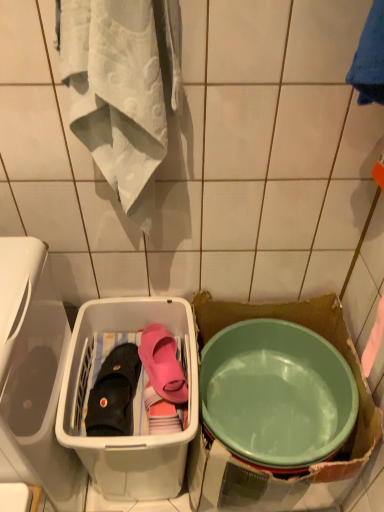
Question: Can you confirm if pink rubber slipper at center, placed as the 1th footwear when sorted from right to left, is smaller than black fabric slipper at lower left, positioned as the second footwear in right-to-left order?

Choices:
 (A) no
 (B) yes

Answer: (B)

Question: From a real-world perspective, is pink rubber slipper at center, placed as the 1th footwear when sorted from right to left, physically below black fabric slipper at lower left, the 1th footwear when ordered from left to right?

Choices:
 (A) no
 (B) yes

Answer: (A)

Question: From the image's perspective, is pink rubber slipper at center, placed as the 1th footwear when sorted from right to left, below black fabric slipper at lower left, positioned as the second footwear in right-to-left order?

Choices:
 (A) no
 (B) yes

Answer: (A)

Question: Is pink rubber slipper at center, which appears as the 2th footwear when viewed from the left, thinner than black fabric slipper at lower left, the 1th footwear when ordered from left to right?

Choices:
 (A) yes
 (B) no

Answer: (A)

Question: Is pink rubber slipper at center, placed as the 1th footwear when sorted from right to left, to the right of black fabric slipper at lower left, positioned as the second footwear in right-to-left order, from the viewer's perspective?

Choices:
 (A) yes
 (B) no

Answer: (A)

Question: Considering the relative sizes of pink rubber slipper at center, placed as the 1th footwear when sorted from right to left, and black fabric slipper at lower left, positioned as the second footwear in right-to-left order, in the image provided, is pink rubber slipper at center, placed as the 1th footwear when sorted from right to left, bigger than black fabric slipper at lower left, positioned as the second footwear in right-to-left order,?

Choices:
 (A) no
 (B) yes

Answer: (A)

Question: From a real-world perspective, is pink rubber slipper at center, placed as the 1th footwear when sorted from right to left, located beneath translucent plastic basket at center?

Choices:
 (A) yes
 (B) no

Answer: (B)

Question: Is pink rubber slipper at center, which appears as the 2th footwear when viewed from the left, facing away from translucent plastic basket at center?

Choices:
 (A) no
 (B) yes

Answer: (B)

Question: Is pink rubber slipper at center, placed as the 1th footwear when sorted from right to left, not near translucent plastic basket at center?

Choices:
 (A) yes
 (B) no

Answer: (B)

Question: Does pink rubber slipper at center, which appears as the 2th footwear when viewed from the left, turn towards translucent plastic basket at center?

Choices:
 (A) no
 (B) yes

Answer: (B)

Question: Considering the relative sizes of pink rubber slipper at center, placed as the 1th footwear when sorted from right to left, and translucent plastic basket at center in the image provided, is pink rubber slipper at center, placed as the 1th footwear when sorted from right to left, bigger than translucent plastic basket at center?

Choices:
 (A) yes
 (B) no

Answer: (B)

Question: Is pink rubber slipper at center, placed as the 1th footwear when sorted from right to left, to the right of translucent plastic basket at center from the viewer's perspective?

Choices:
 (A) no
 (B) yes

Answer: (B)

Question: Is green plastic bowl at lower right located outside black fabric slipper at lower left, positioned as the second footwear in right-to-left order?

Choices:
 (A) no
 (B) yes

Answer: (B)